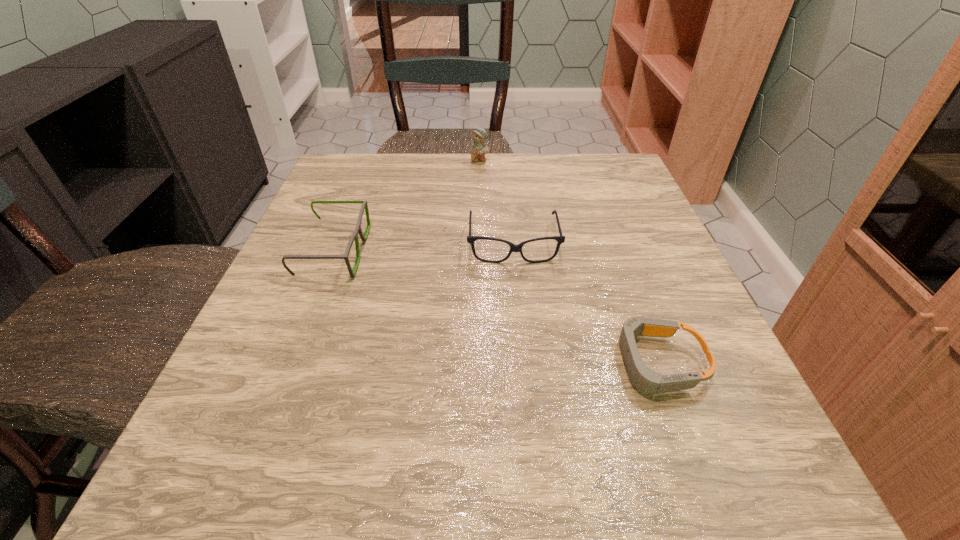
Where is `vacant position located 0.120m on the front and back of the goggles`? The image size is (960, 540). vacant position located 0.120m on the front and back of the goggles is located at coordinates (526, 363).

Find the location of `free space located on the front and back of the goggles`. free space located on the front and back of the goggles is located at coordinates (401, 363).

At what (x,y) coordinates should I click in order to perform the action: click on object that is at the far edge. Please return your answer as a coordinate pair (x, y). Looking at the image, I should click on (478, 148).

Identify the location of object present at the left edge. This screenshot has height=540, width=960. (358, 229).

Locate an element on the screen. This screenshot has width=960, height=540. object located at the right edge is located at coordinates (645, 380).

Locate an element on the screen. This screenshot has width=960, height=540. free space at the far edge of the desktop is located at coordinates (523, 156).

In the image, there is a desktop. In order to click on free space at the left edge in this screenshot , I will do point(296,266).

You are a GUI agent. You are given a task and a screenshot of the screen. Output one action in this format:
    pyautogui.click(x=<x>, y=<y>)
    Task: Click on the vacant space at the right edge of the desktop
    This screenshot has width=960, height=540.
    Given the screenshot: What is the action you would take?
    pyautogui.click(x=655, y=302)

Where is `vacant space at the far left corner of the desktop`? This screenshot has height=540, width=960. vacant space at the far left corner of the desktop is located at coordinates (336, 163).

Where is `vacant space at the near left corner of the desktop`? The height and width of the screenshot is (540, 960). vacant space at the near left corner of the desktop is located at coordinates (189, 442).